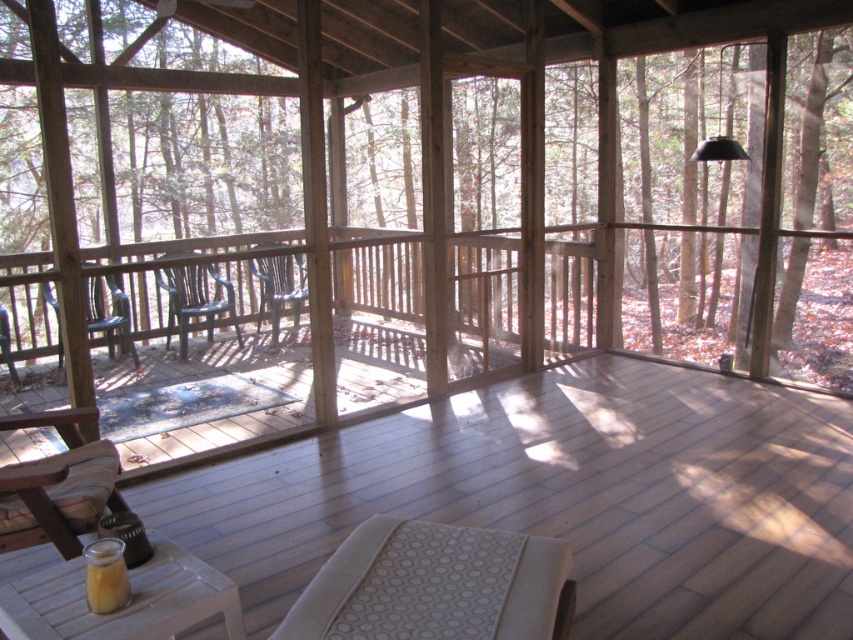
You are sitting on the wooden chair at center and want to grab the translucent glass cup at lower left. Which direction should you move to reach it?

The translucent glass cup at lower left is to the right of the wooden chair at center, so you should move to your right to reach it.

You are standing at the entrance of the porch and want to reach the metallic blue chair at center. What is the shortest path you can take without crossing any obstacles?

The shortest path to the metallic blue chair at center is to move straight forward from the entrance towards the coordinates where the metallic blue chair at center is located at point [195,300], as there are no obstacles mentioned in the scene description blocking the path.

You are a delivery person trying to place a heavy box on the wooden deck at center. The box is as tall as the translucent glass cup at lower left. Will the box fit on the deck without exceeding its height limit?

The wooden deck at center has a greater height compared to the translucent glass cup at lower left. Since the box is as tall as the cup, it will not exceed the deck height limit, so it can be placed there safely.